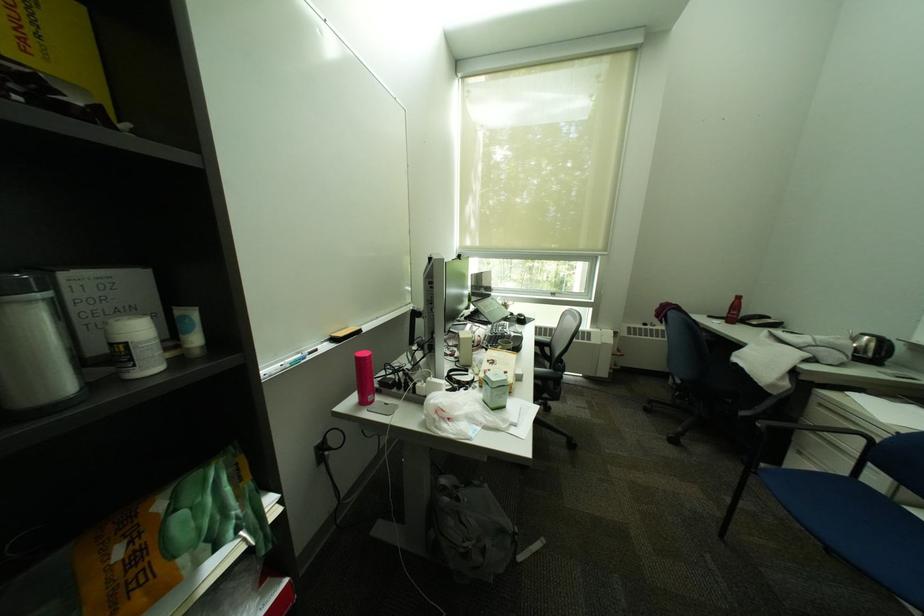
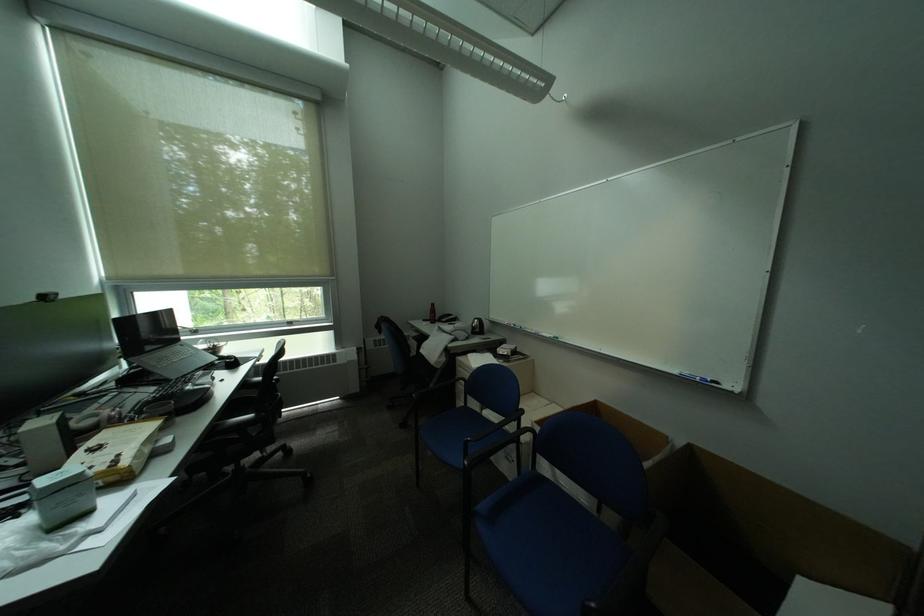
Question: The images are taken continuously from a first-person perspective. In which direction is your viewpoint rotating?

Choices:
 (A) Left
 (B) Right
 (C) Up
 (D) Down

Answer: (B)